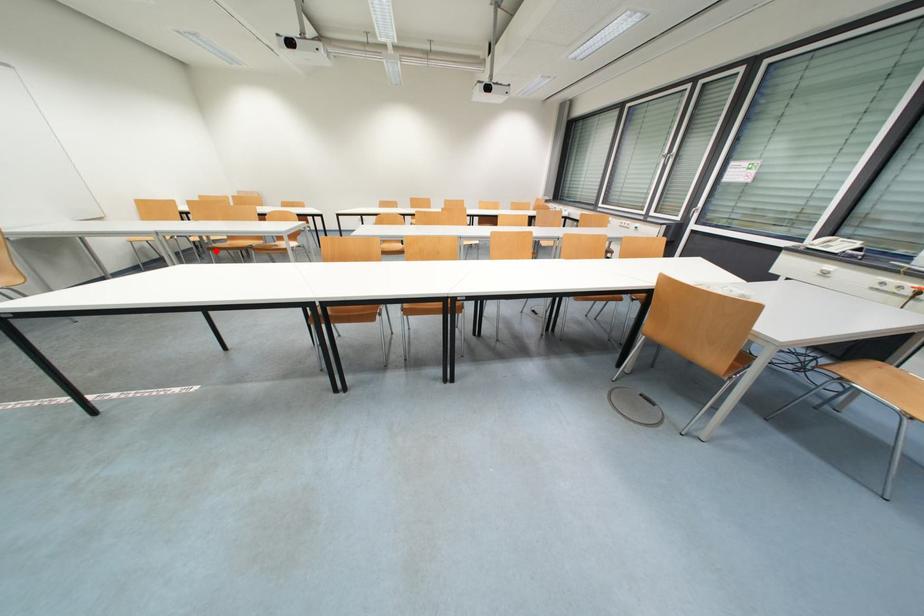
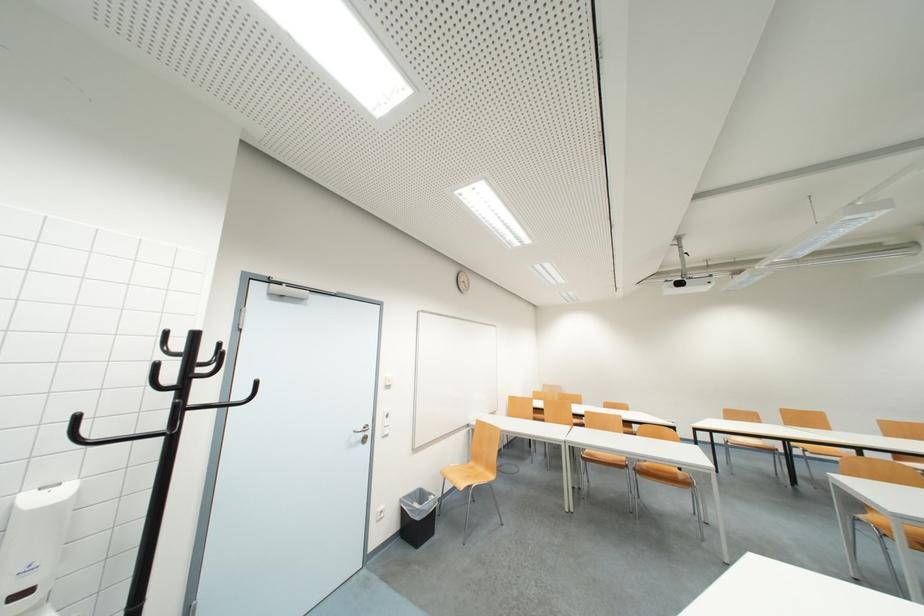
Where in the second image is the point corresponding to the highlighted location from the first image?

(590, 461)